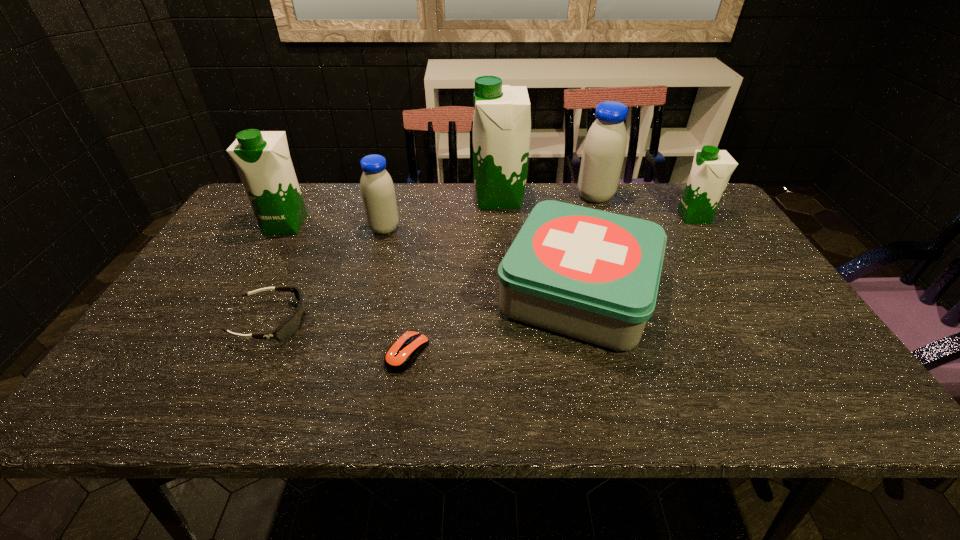
In order to click on object present at the far right corner in this screenshot , I will do `click(711, 169)`.

Image resolution: width=960 pixels, height=540 pixels. In order to click on free space at the far edge of the desktop in this screenshot , I will do `click(327, 208)`.

This screenshot has width=960, height=540. I want to click on free space at the near edge of the desktop, so click(607, 380).

At what (x,y) coordinates should I click in order to perform the action: click on vacant space at the left edge of the desktop. Please return your answer as a coordinate pair (x, y). Looking at the image, I should click on (262, 254).

In the image, there is a desktop. Where is `vacant area at the right edge`? Image resolution: width=960 pixels, height=540 pixels. vacant area at the right edge is located at coordinates (740, 287).

Identify the location of vacant space at the near left corner of the desktop. (124, 390).

Where is `free spot between the leftmost soya milk and the bigger blue soya milk`? This screenshot has height=540, width=960. free spot between the leftmost soya milk and the bigger blue soya milk is located at coordinates tap(441, 210).

The image size is (960, 540). I want to click on empty space between the third soya milk from right to left and the fourth soya milk from left to right, so click(547, 198).

At what (x,y) coordinates should I click in order to perform the action: click on free space between the fifth object from right to left and the second shortest object. Please return your answer as a coordinate pair (x, y). Image resolution: width=960 pixels, height=540 pixels. Looking at the image, I should click on (340, 338).

Locate an element on the screen. The image size is (960, 540). vacant space in between the rightmost soya milk and the second shortest object is located at coordinates (483, 269).